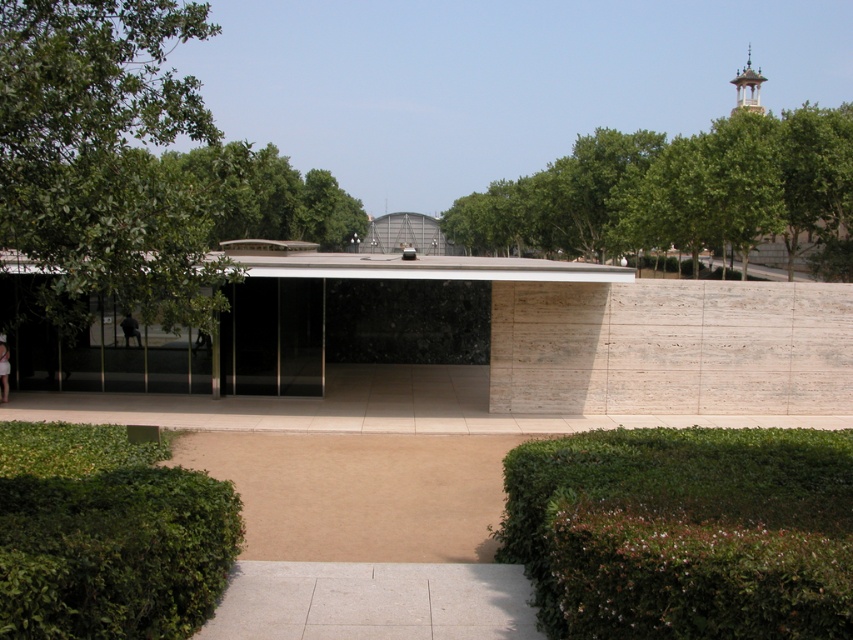
You are standing in front of the modern architectural structure and see a point marked at coordinates [677,192]. Based on the scene description, can you determine what object this point is located on?

The point at coordinates [677,192] is located on the green leafy tree at upper right.